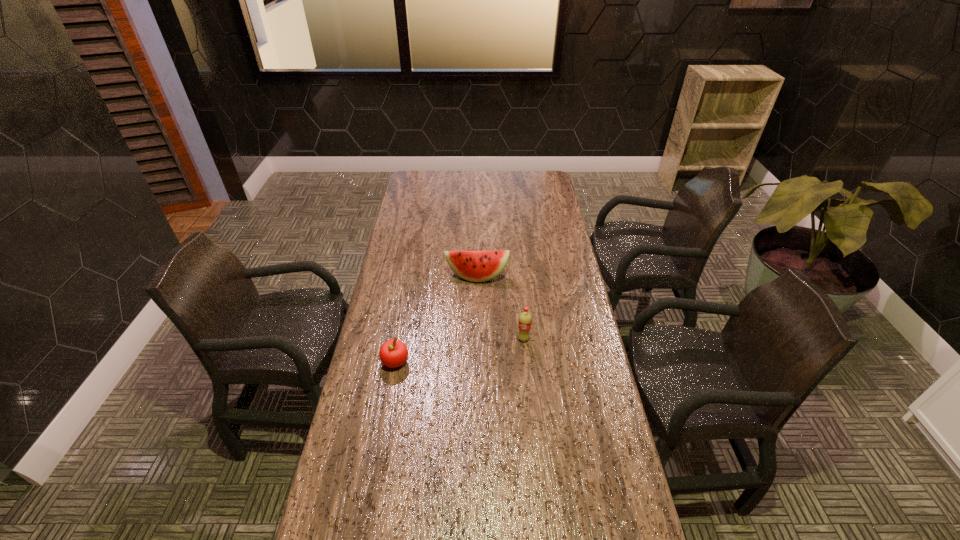
Identify the location of the closest object to the soda. pos(476,266).

This screenshot has height=540, width=960. Find the location of `vacant space that satisfies the following two spatial constraints: 1. on the back side of the soda; 2. on the left side of the shortest object`. vacant space that satisfies the following two spatial constraints: 1. on the back side of the soda; 2. on the left side of the shortest object is located at coordinates (399, 339).

The width and height of the screenshot is (960, 540). What are the coordinates of `free space that satisfies the following two spatial constraints: 1. on the outer rind of the watermelon; 2. on the left side of the soda` in the screenshot? It's located at (476, 339).